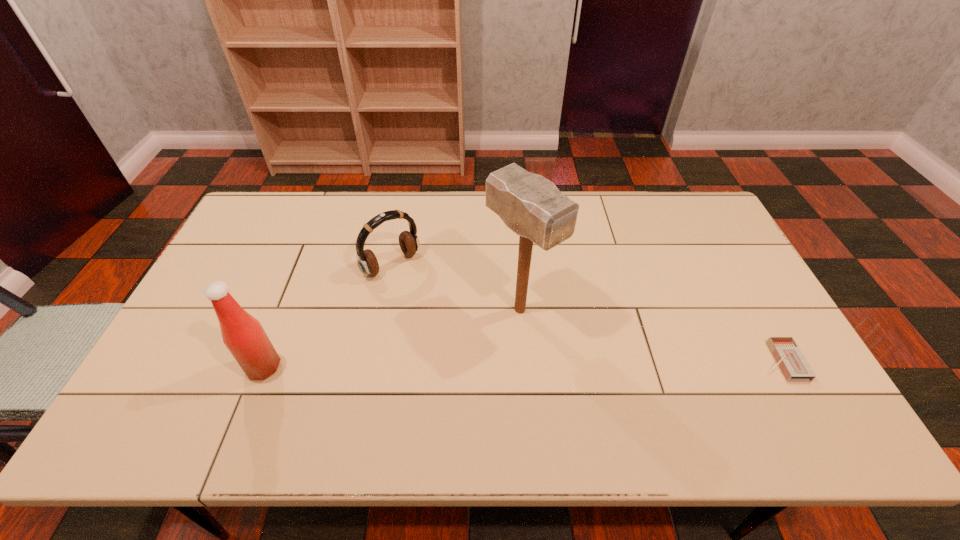
Where is `vacant spot on the desktop that is between the second tallest object and the matchbox and is positioned on the ear cup of the headset`? The image size is (960, 540). vacant spot on the desktop that is between the second tallest object and the matchbox and is positioned on the ear cup of the headset is located at coordinates (490, 364).

The image size is (960, 540). What are the coordinates of `free spot on the desktop that is between the leftmost object and the matchbox and is positioned above the head of the mallet` in the screenshot? It's located at (579, 364).